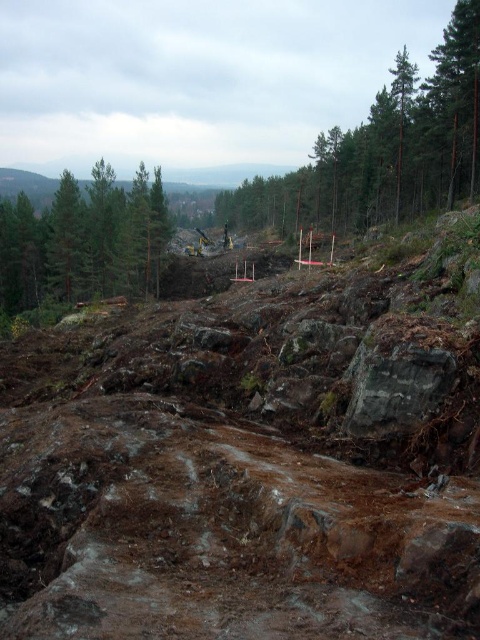
You are a delivery driver needing to reach a construction site. You see a brown earthy dirt track at center and a green textured tree at center in the image. Which one is closer to the construction site?

The brown earthy dirt track at center is closer to the construction site because it is positioned at the center, while the green textured tree at center is farther away. However, according to the description, both are at center but the distance between them is 134.72 meters. The question is ambiguous as both are at center but separated by that distance. The correct answer should be that the distance between them is 134.72 meters, so neither is closer if they are both at the center. Alternatively, perhaps re